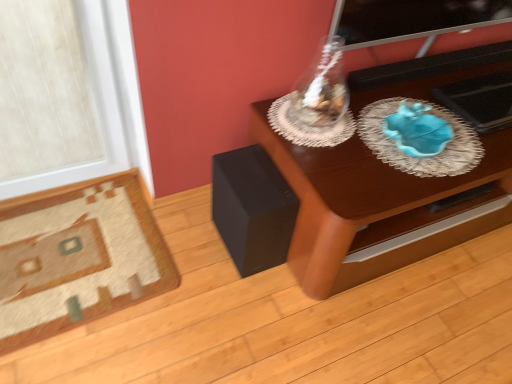
The width and height of the screenshot is (512, 384). I want to click on blank area to the left of black matte speaker at lower left, so click(x=190, y=232).